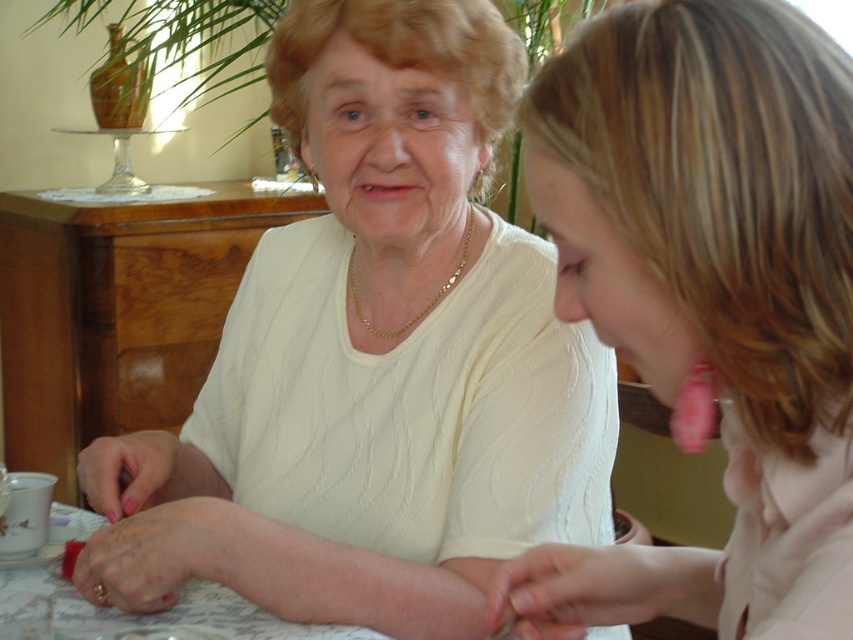
From the picture: Who is shorter, white knit sweater at center or white fabric table at lower left?

With less height is white fabric table at lower left.

Consider the image. Who is taller, white knit sweater at center or white fabric table at lower left?

white knit sweater at center is taller.

I want to click on white knit sweater at center, so pos(373,358).

Between pink fabric ear at upper right and white fabric table at lower left, which one is positioned lower?

white fabric table at lower left is below.

Does pink fabric ear at upper right have a lesser height compared to white fabric table at lower left?

Incorrect, pink fabric ear at upper right's height does not fall short of white fabric table at lower left's.

This screenshot has width=853, height=640. What are the coordinates of `pink fabric ear at upper right` in the screenshot? It's located at (708, 292).

Is white knit sweater at center wider than pink fabric ear at upper right?

Yes.

How distant is white knit sweater at center from pink fabric ear at upper right?

white knit sweater at center and pink fabric ear at upper right are 13.09 inches apart from each other.

At what (x,y) coordinates should I click in order to perform the action: click on white knit sweater at center. Please return your answer as a coordinate pair (x, y). This screenshot has width=853, height=640. Looking at the image, I should click on (373, 358).

This screenshot has width=853, height=640. I want to click on white knit sweater at center, so click(x=373, y=358).